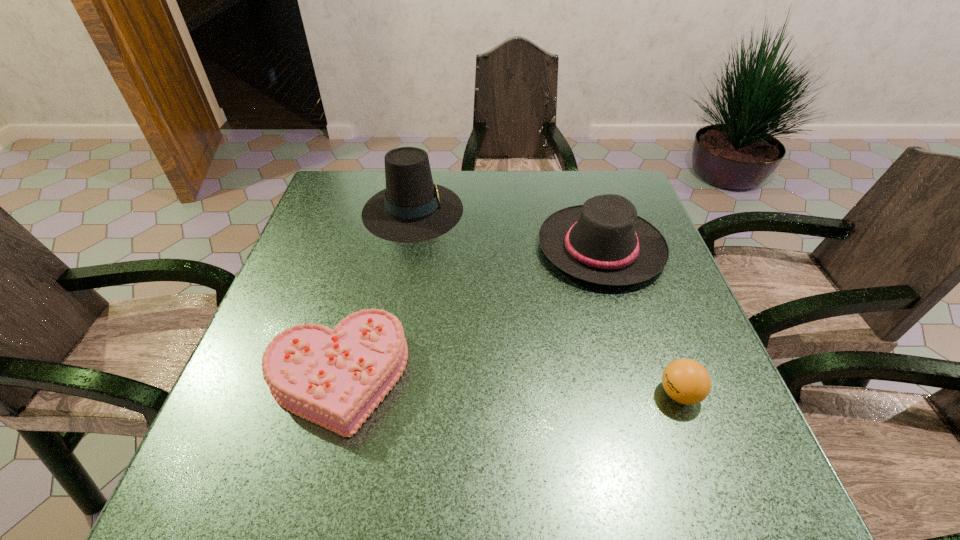
Where is `free location located on the side with brand of the ping-pong ball`? free location located on the side with brand of the ping-pong ball is located at coordinates (598, 394).

Where is `vacant space located on the right of the cake`? Image resolution: width=960 pixels, height=540 pixels. vacant space located on the right of the cake is located at coordinates (588, 376).

You are a GUI agent. You are given a task and a screenshot of the screen. Output one action in this format:
    pyautogui.click(x=<x>, y=<y>)
    Task: Click on the hat positioned at the left edge
    
    Given the screenshot: What is the action you would take?
    pyautogui.click(x=411, y=209)

Image resolution: width=960 pixels, height=540 pixels. Find the location of `cake situated at the left edge`. cake situated at the left edge is located at coordinates (335, 378).

Locate an element on the screen. The image size is (960, 540). dress hat that is at the right edge is located at coordinates (604, 241).

This screenshot has height=540, width=960. Identify the location of ping-pong ball located in the right edge section of the desktop. (686, 381).

Image resolution: width=960 pixels, height=540 pixels. Find the location of `object located at the far left corner`. object located at the far left corner is located at coordinates (411, 209).

Locate an element on the screen. object located at the far right corner is located at coordinates (604, 241).

Locate an element on the screen. The width and height of the screenshot is (960, 540). vacant space at the far edge is located at coordinates (468, 191).

Locate an element on the screen. vacant space at the near edge of the desktop is located at coordinates (363, 480).